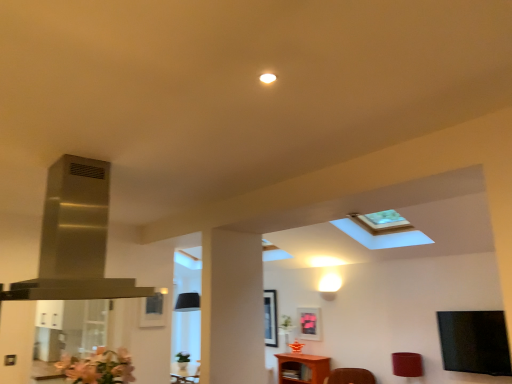
Question: From the image's perspective, is matte red lampshade at lower right beneath brown wooden table at lower center?

Choices:
 (A) yes
 (B) no

Answer: (B)

Question: Is matte red lampshade at lower right to the right of brown wooden table at lower center from the viewer's perspective?

Choices:
 (A) no
 (B) yes

Answer: (B)

Question: Would you say brown wooden table at lower center is part of matte red lampshade at lower right's contents?

Choices:
 (A) no
 (B) yes

Answer: (A)

Question: Is matte red lampshade at lower right oriented towards brown wooden table at lower center?

Choices:
 (A) no
 (B) yes

Answer: (A)

Question: Is brown wooden table at lower center at the back of matte red lampshade at lower right?

Choices:
 (A) no
 (B) yes

Answer: (A)

Question: Is transparent glass door at left situated inside matte red lampshade at lower right or outside?

Choices:
 (A) outside
 (B) inside

Answer: (A)

Question: In the image, is transparent glass door at left positioned in front of or behind matte red lampshade at lower right?

Choices:
 (A) front
 (B) behind

Answer: (A)

Question: From a real-world perspective, is transparent glass door at left physically located above or below matte red lampshade at lower right?

Choices:
 (A) above
 (B) below

Answer: (A)

Question: From the image's perspective, is transparent glass door at left positioned above or below matte red lampshade at lower right?

Choices:
 (A) above
 (B) below

Answer: (A)

Question: Is matte pink picture frame at center, which is the second picture frame in back-to-front order, situated inside stainless steel exhaust hood at upper left or outside?

Choices:
 (A) outside
 (B) inside

Answer: (A)

Question: Is matte pink picture frame at center, which is the second picture frame in back-to-front order, in front of or behind stainless steel exhaust hood at upper left in the image?

Choices:
 (A) front
 (B) behind

Answer: (B)

Question: Considering the positions of matte pink picture frame at center, the third picture frame when ordered from left to right, and stainless steel exhaust hood at upper left in the image, is matte pink picture frame at center, the third picture frame when ordered from left to right, bigger or smaller than stainless steel exhaust hood at upper left?

Choices:
 (A) big
 (B) small

Answer: (B)

Question: Is point (303, 319) positioned closer to the camera than point (86, 195)?

Choices:
 (A) closer
 (B) farther

Answer: (B)

Question: Looking at their shapes, would you say stainless steel exhaust hood at upper left is wider or thinner than matte pink picture frame at center, the 2th picture frame from the front?

Choices:
 (A) thin
 (B) wide

Answer: (B)

Question: Choose the correct answer: Is stainless steel exhaust hood at upper left inside matte pink picture frame at center, the first picture frame viewed from the right, or outside it?

Choices:
 (A) outside
 (B) inside

Answer: (A)